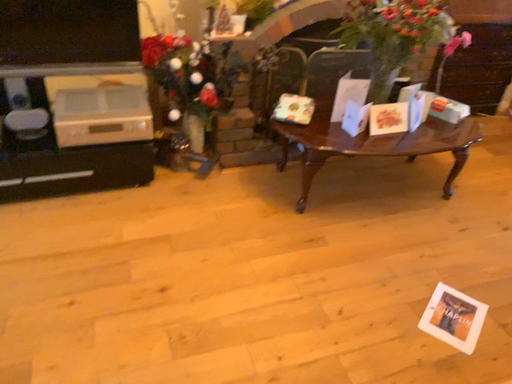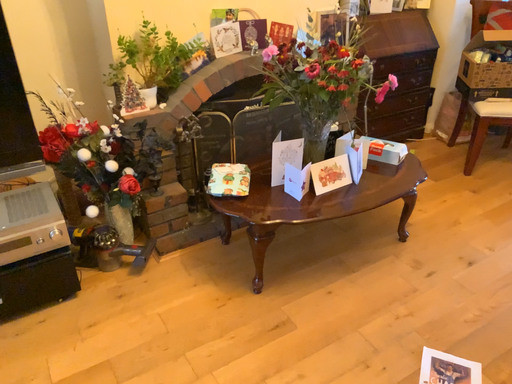
Question: How did the camera likely rotate when shooting the video?

Choices:
 (A) rotated right
 (B) rotated left

Answer: (A)